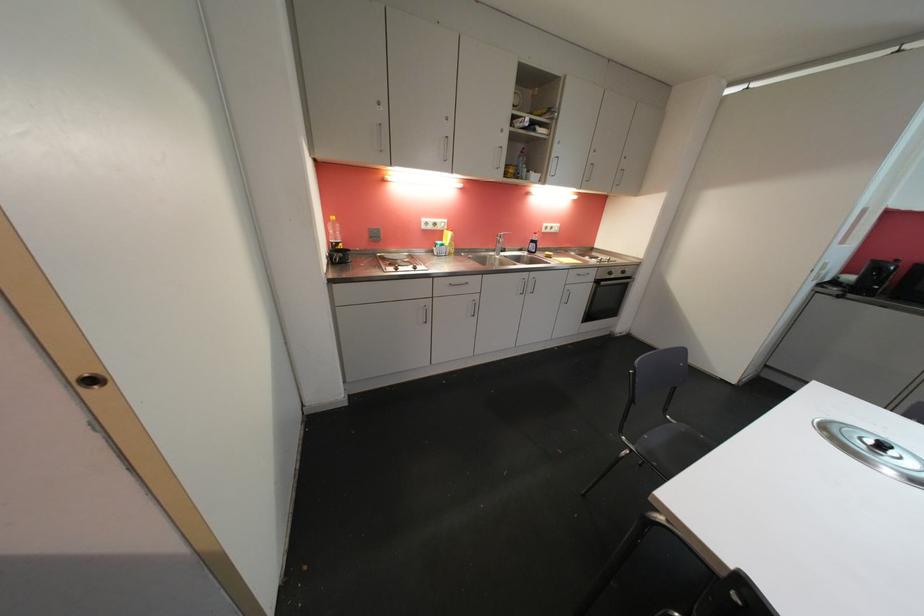
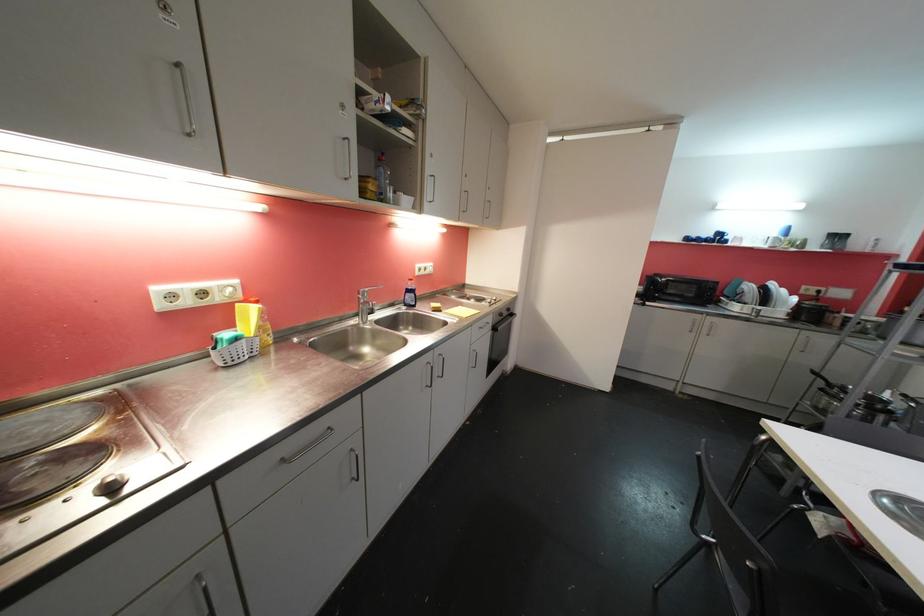
Question: The images are taken continuously from a first-person perspective. In which direction is your viewpoint rotating?

Choices:
 (A) Left
 (B) Right
 (C) Up
 (D) Down

Answer: (B)